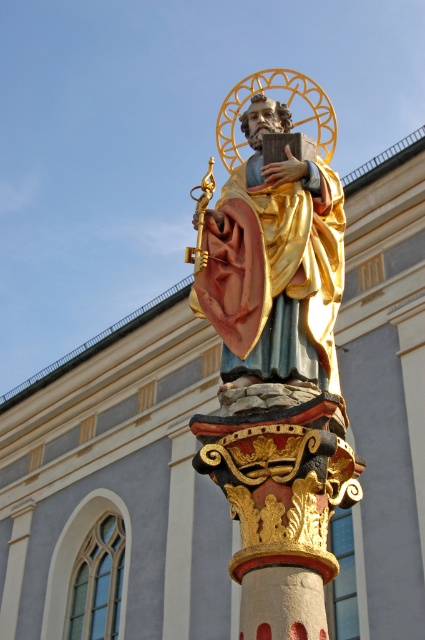
Question: Is gold plated statue at center positioned in front of gold leaf statue at center?

Choices:
 (A) yes
 (B) no

Answer: (A)

Question: Can you confirm if gold plated statue at center is bigger than gold leaf statue at center?

Choices:
 (A) yes
 (B) no

Answer: (A)

Question: Is gold plated statue at center below gold leaf statue at center?

Choices:
 (A) yes
 (B) no

Answer: (B)

Question: Among these objects, which one is nearest to the camera?

Choices:
 (A) gold leaf statue at center
 (B) gold plated statue at center

Answer: (B)

Question: Among these points, which one is nearest to the camera?

Choices:
 (A) (248, 352)
 (B) (277, 348)

Answer: (A)